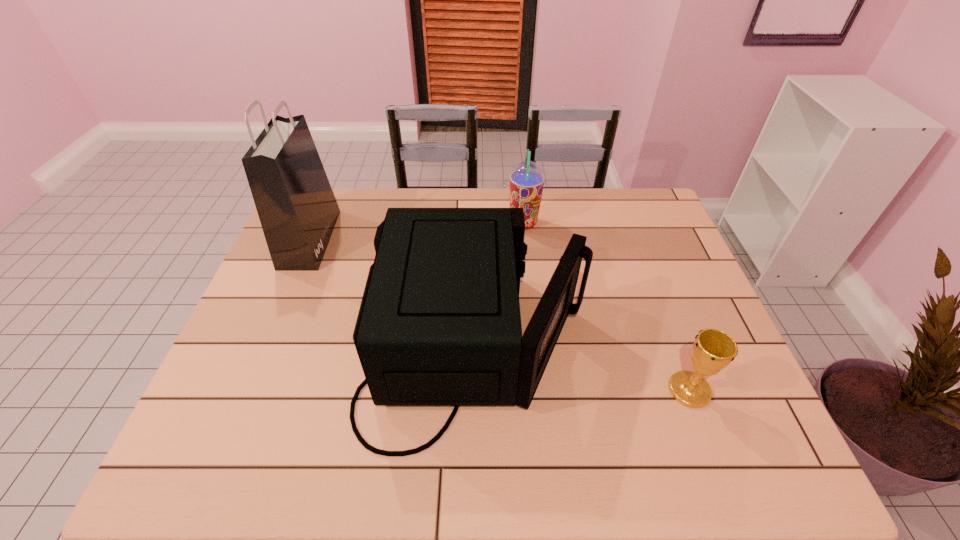
Where is `blank region between the smoothie and the shortest object`? blank region between the smoothie and the shortest object is located at coordinates (607, 306).

At what (x,y) coordinates should I click in order to perform the action: click on free spot between the shortest object and the microwave oven. Please return your answer as a coordinate pair (x, y). The image size is (960, 540). Looking at the image, I should click on click(x=582, y=368).

Locate an element on the screen. free space between the shortest object and the smoothie is located at coordinates (607, 306).

At what (x,y) coordinates should I click in order to perform the action: click on object that stands as the third closest to the microwave oven. Please return your answer as a coordinate pair (x, y). The width and height of the screenshot is (960, 540). Looking at the image, I should click on (297, 209).

I want to click on object that stands as the third closest to the microwave oven, so click(x=297, y=209).

At what (x,y) coordinates should I click in order to perform the action: click on vacant space that satisfies the following two spatial constraints: 1. with the door open on the shortest object; 2. on the left side of the microwave oven. Please return your answer as a coordinate pair (x, y). Image resolution: width=960 pixels, height=540 pixels. Looking at the image, I should click on (474, 390).

Image resolution: width=960 pixels, height=540 pixels. What are the coordinates of `vacant area that satisfies the following two spatial constraints: 1. with the door open on the microwave oven; 2. on the left side of the rightmost object` in the screenshot? It's located at 474,390.

This screenshot has height=540, width=960. I want to click on free spot that satisfies the following two spatial constraints: 1. with the door open on the microwave oven; 2. on the right side of the shortest object, so click(x=474, y=390).

At what (x,y) coordinates should I click in order to perform the action: click on free space that satisfies the following two spatial constraints: 1. on the front with handles of the leftmost object; 2. on the right side of the shortest object. Please return your answer as a coordinate pair (x, y). The height and width of the screenshot is (540, 960). Looking at the image, I should click on (247, 390).

Identify the location of vacant region that satisfies the following two spatial constraints: 1. on the front with handles of the shopping bag; 2. on the left side of the shortest object. The width and height of the screenshot is (960, 540). (247, 390).